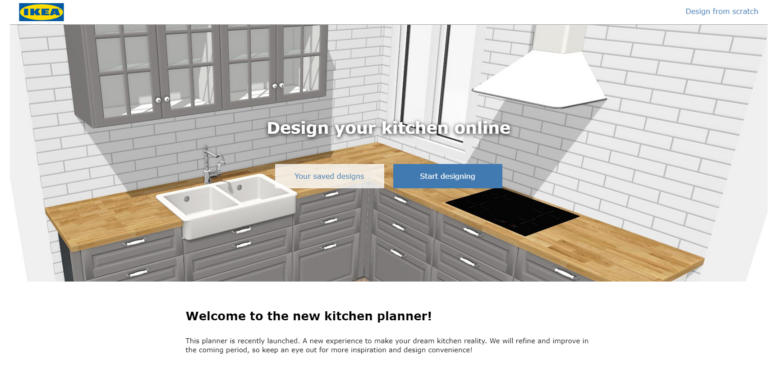
Where is `spot where two walls meet`? Image resolution: width=768 pixels, height=382 pixels. spot where two walls meet is located at coordinates (379, 56).